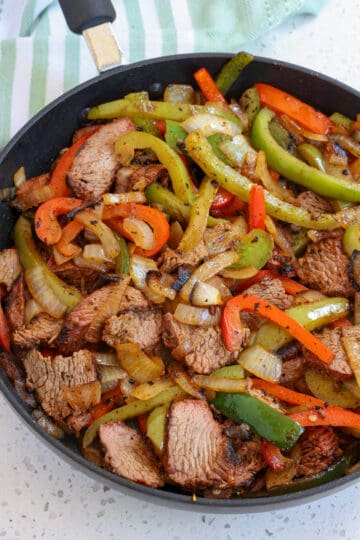
You are a GUI agent. You are given a task and a screenshot of the screen. Output one action in this format:
    pyautogui.click(x=<x>, y=<y>)
    Task: Click on the handle
    
    Given the screenshot: What is the action you would take?
    pyautogui.click(x=108, y=46)